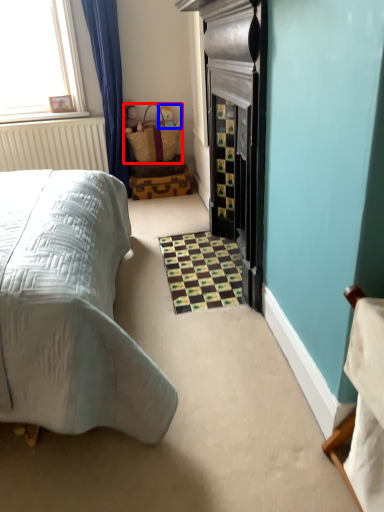
Question: Which point is further to the camera, basket (highlighted by a red box) or toy (highlighted by a blue box)?

Choices:
 (A) basket
 (B) toy

Answer: (B)